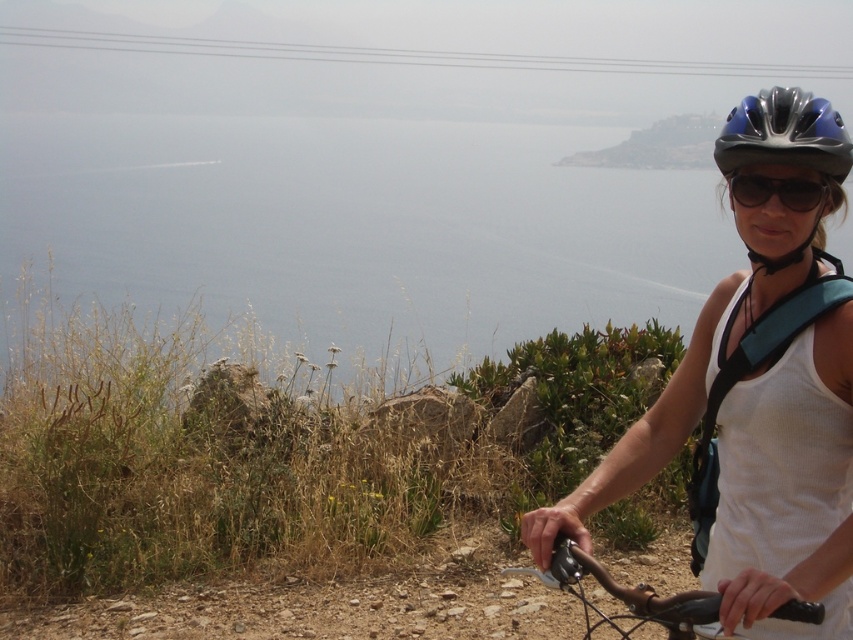
You are a photographer trying to capture the blue matte bicycle helmet at upper right and the black matte sunglasses at upper right in the same frame. Based on their positions, which object should you adjust your camera to focus on first if you want to include both in your shot?

The blue matte bicycle helmet at upper right is to the left of the black matte sunglasses at upper right, so you should focus on the blue matte bicycle helmet at upper right first to ensure both are in frame.

You are a photographer trying to capture the rider and their gear. Given the white fabric tank top at right and the shiny metallic bicycle handlebars at lower right, which object appears wider in the photo?

The white fabric tank top at right appears wider than the shiny metallic bicycle handlebars at lower right because its width surpasses the handlebars.

You are a fashion designer analyzing the image. You need to determine which item of clothing or accessory has a bigger size between the white fabric tank top at right and the blue matte bicycle helmet at upper right. Which one is larger?

The white fabric tank top at right has a larger size compared to the blue matte bicycle helmet at upper right, so the white fabric tank top at right is bigger.